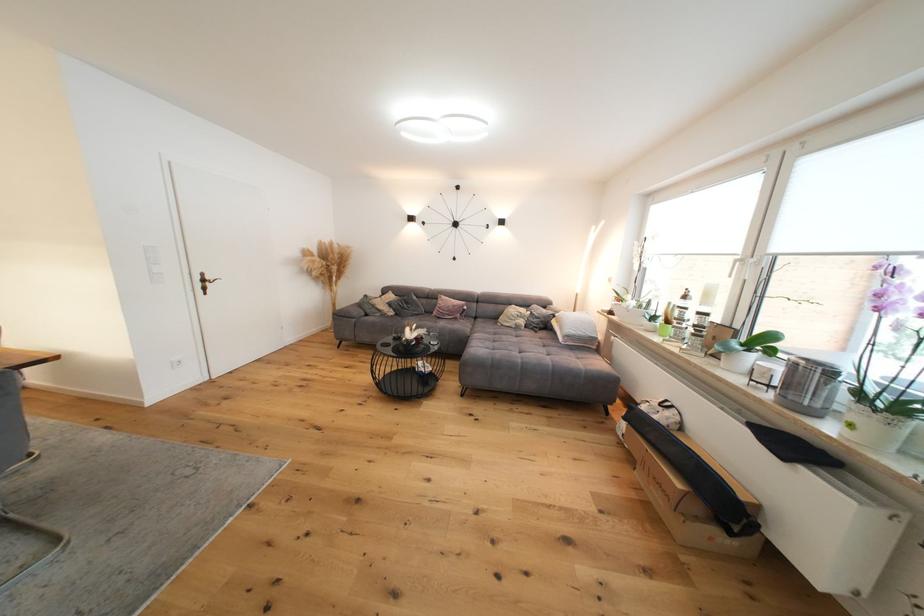
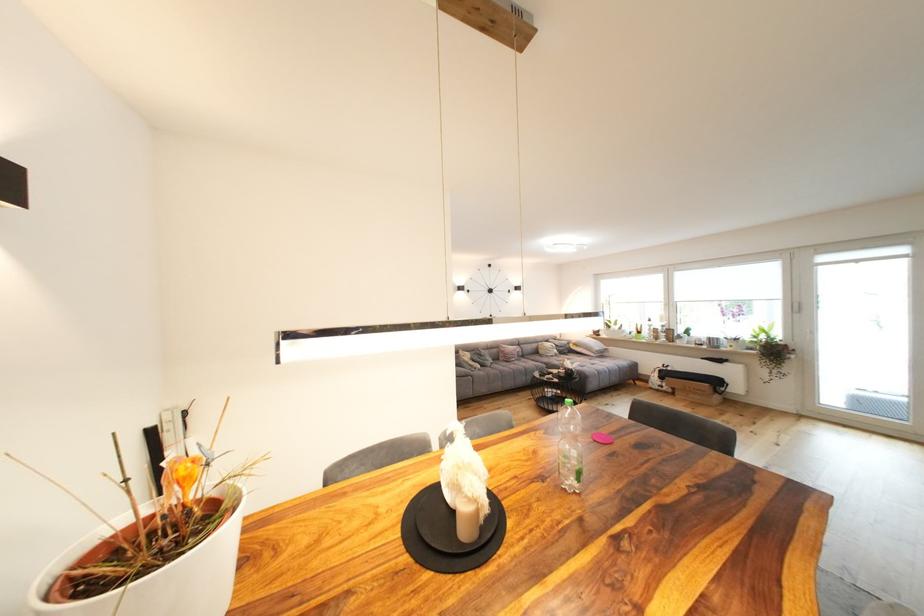
Where in the second image is the point corresponding to (398,315) from the first image?

(485, 368)